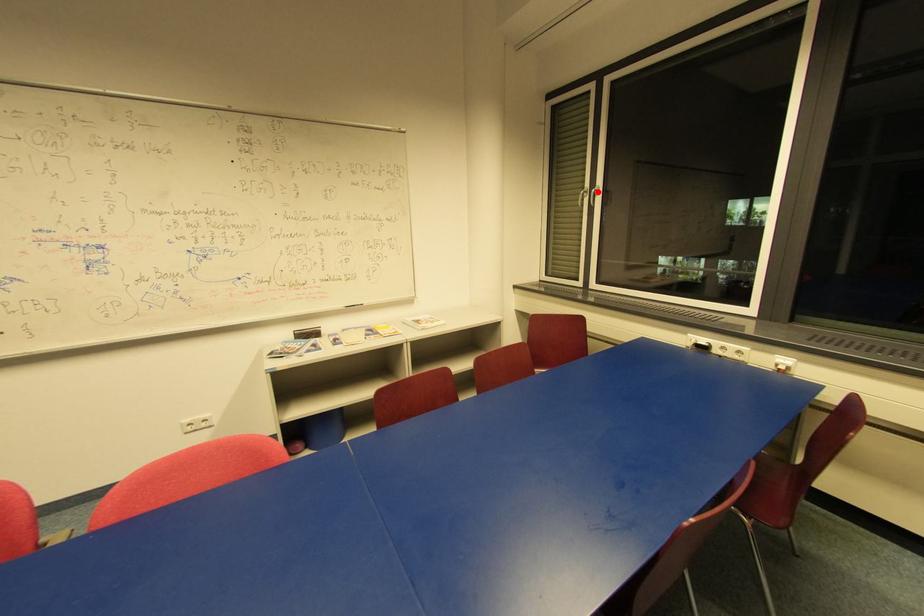
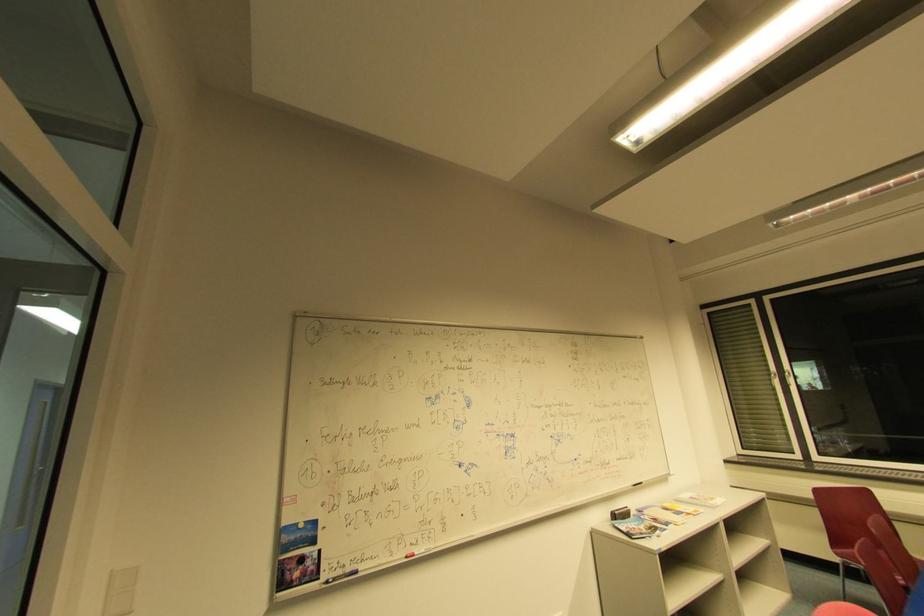
Question: I am providing you with two images of the same scene from different viewpoints. Given a red point in image1, look at the same physical point in image2. Is it:

Choices:
 (A) Closer to the viewpoint
 (B) Farther from the viewpoint

Answer: (A)